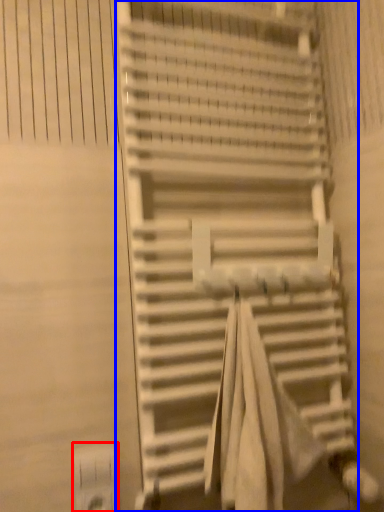
Question: Which object is further to the camera taking this photo, electric outlet (highlighted by a red box) or stairs (highlighted by a blue box)?

Choices:
 (A) electric outlet
 (B) stairs

Answer: (A)